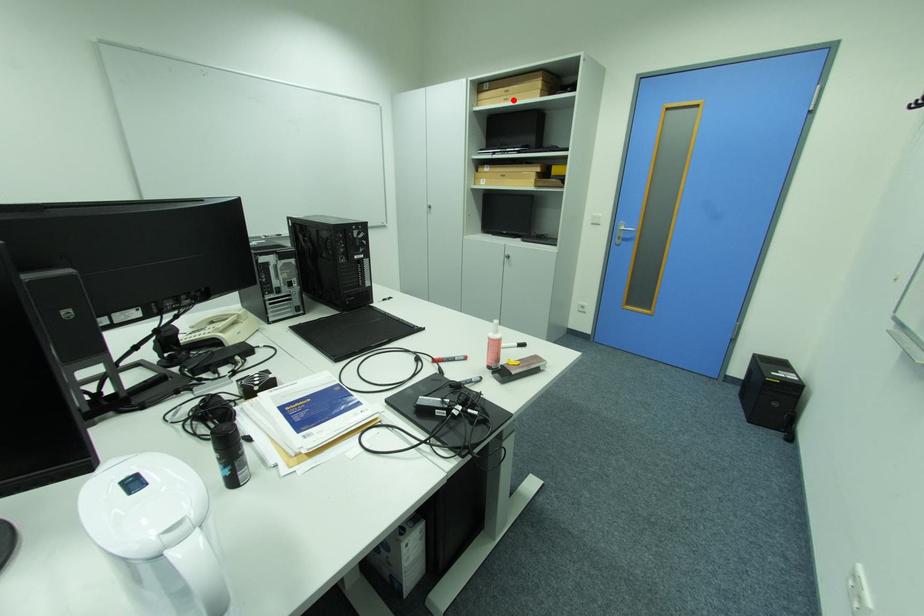
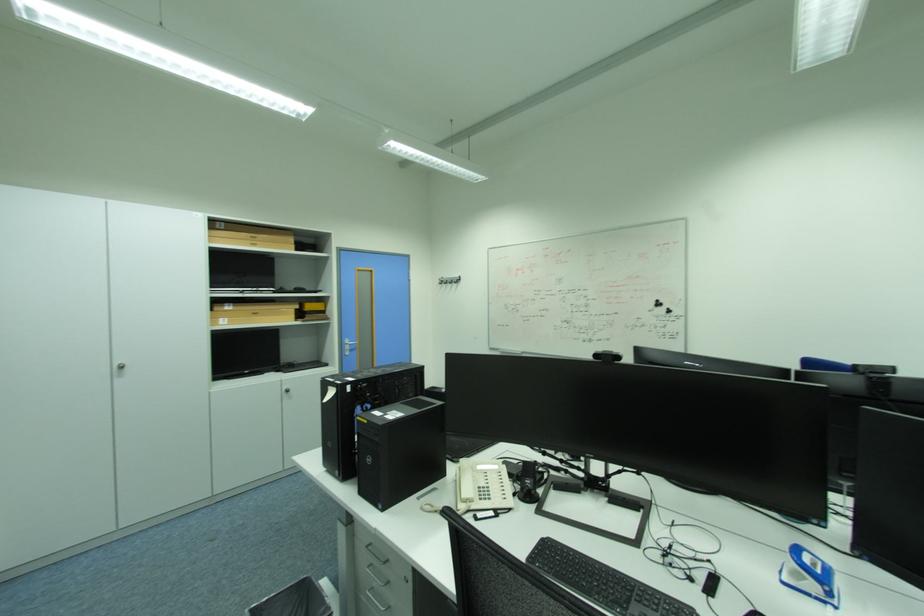
Question: I am providing you with two images of the same scene from different viewpoints. Given a red point in image1, look at the same physical point in image2. Is it:

Choices:
 (A) Closer to the viewpoint
 (B) Farther from the viewpoint

Answer: (B)